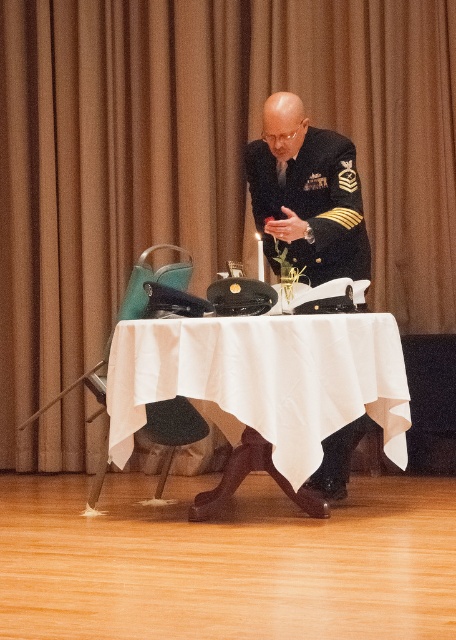
Between point (378, 243) and point (289, 93), which one is positioned behind?

Point (378, 243)

This screenshot has height=640, width=456. Describe the element at coordinates (197, 164) in the screenshot. I see `brown fabric curtain at upper center` at that location.

The width and height of the screenshot is (456, 640). In order to click on brown fabric curtain at upper center in this screenshot , I will do `click(197, 164)`.

Can you confirm if white cloth-covered table at center is thinner than black uniform at center?

In fact, white cloth-covered table at center might be wider than black uniform at center.

Is point (130, 445) closer to camera compared to point (326, 131)?

That is True.

Which is in front, point (330, 433) or point (289, 188)?

Point (330, 433) is in front.

Find the location of a particular element. The image size is (456, 640). white cloth-covered table at center is located at coordinates (264, 385).

Is brown fabric curtain at upper center to the left of white cloth-covered table at center from the viewer's perspective?

Indeed, brown fabric curtain at upper center is positioned on the left side of white cloth-covered table at center.

Between brown fabric curtain at upper center and white cloth-covered table at center, which one is positioned higher?

brown fabric curtain at upper center is higher up.

Which is in front, point (175, 225) or point (169, 349)?

Positioned in front is point (169, 349).

At what (x,y) coordinates should I click in order to perform the action: click on brown fabric curtain at upper center. Please return your answer as a coordinate pair (x, y). Looking at the image, I should click on (197, 164).